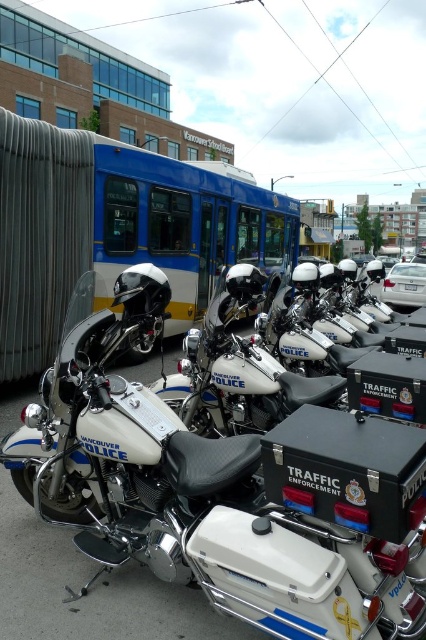
You are a delivery person who needs to park your van, which is 2 meters wide, between the blue metallic bus at upper center and the white matte police motorcycle at center. Can you fit your van there?

The blue metallic bus at upper center is bigger than the white matte police motorcycle at center, but the size comparison doesn not provide information about the distance between them. Without knowing the space between the two objects, it is impossible to determine if the van can fit.

Looking at this image, you are a pedestrian standing in front of the Vancouver School Board bus. You see two police motorcycles at center. Which motorcycle is closer to you, the white metallic police motorcycle at center or the white matte police motorcycle at center?

The white metallic police motorcycle at center is closer to you because it is positioned below the white matte police motorcycle at center, which places it lower in the scene and thus nearer to your viewpoint.